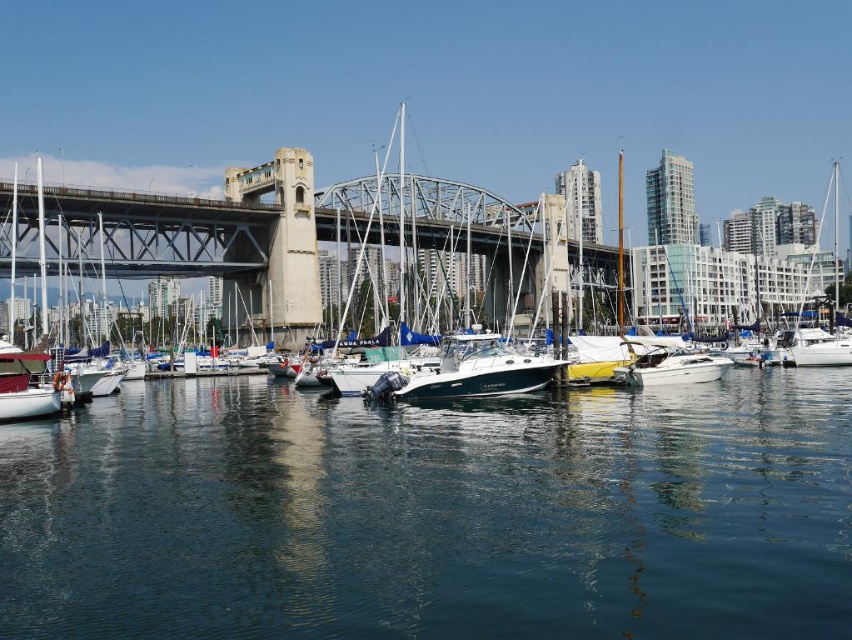
Which of these two, shiny blue boat at center or white matte sailboat at lower left, stands taller?

With more height is white matte sailboat at lower left.

Does shiny blue boat at center have a lesser height compared to white matte sailboat at lower left?

Indeed, shiny blue boat at center has a lesser height compared to white matte sailboat at lower left.

The image size is (852, 640). Find the location of `shiny blue boat at center`. shiny blue boat at center is located at coordinates (478, 371).

Can you confirm if concrete bridge at center is positioned below shiny blue boat at center?

Incorrect, concrete bridge at center is not positioned below shiny blue boat at center.

Based on the photo, who is positioned more to the left, concrete bridge at center or shiny blue boat at center?

From the viewer's perspective, concrete bridge at center appears more on the left side.

Is point (478, 236) behind point (459, 385)?

Yes.

Where is `concrete bridge at center`? The height and width of the screenshot is (640, 852). concrete bridge at center is located at coordinates (298, 243).

Is clear blue water at center smaller than shiny blue boat at center?

Incorrect, clear blue water at center is not smaller in size than shiny blue boat at center.

At what (x,y) coordinates should I click in order to perform the action: click on clear blue water at center. Please return your answer as a coordinate pair (x, y). This screenshot has height=640, width=852. Looking at the image, I should click on (433, 515).

Locate an element on the screen. The image size is (852, 640). clear blue water at center is located at coordinates (433, 515).